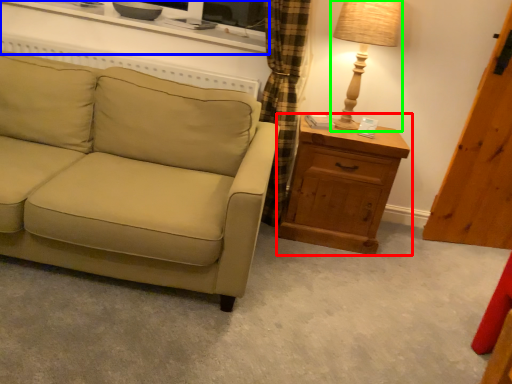
Question: Which object is the farthest from chest of drawers (highlighted by a red box)? Choose among these: entertainment center (highlighted by a blue box) or table lamp (highlighted by a green box).

Choices:
 (A) entertainment center
 (B) table lamp

Answer: (A)